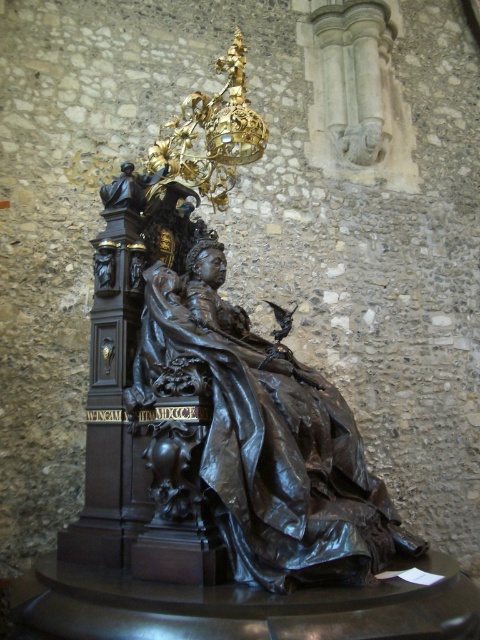
Question: Does bronze statue at center have a larger size compared to shiny bronze statue at center?

Choices:
 (A) no
 (B) yes

Answer: (B)

Question: Which point is farther to the camera?

Choices:
 (A) (120, 560)
 (B) (420, 554)

Answer: (B)

Question: Is bronze statue at center thinner than shiny bronze statue at center?

Choices:
 (A) yes
 (B) no

Answer: (B)

Question: Considering the relative positions of bronze statue at center and shiny bronze statue at center in the image provided, where is bronze statue at center located with respect to shiny bronze statue at center?

Choices:
 (A) above
 (B) below

Answer: (A)

Question: Which object is closer to the camera taking this photo?

Choices:
 (A) bronze statue at center
 (B) shiny bronze statue at center

Answer: (B)